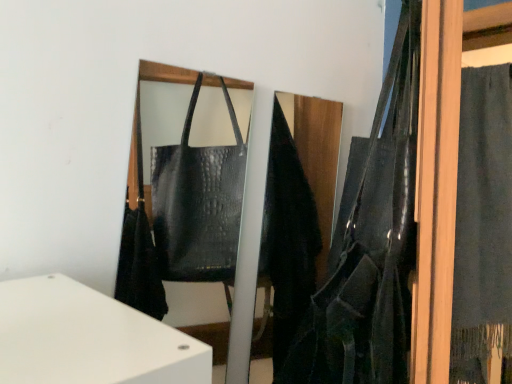
Where is `leather textured shoulder bag at right`? leather textured shoulder bag at right is located at coordinates (370, 245).

What do you see at coordinates (370, 245) in the screenshot? I see `leather textured shoulder bag at right` at bounding box center [370, 245].

What is the approximate height of leather textured shoulder bag at right?

leather textured shoulder bag at right is 84.03 centimeters in height.

Describe the element at coordinates (483, 228) in the screenshot. The image size is (512, 384). I see `dark blue fabric at right` at that location.

Identify the location of dark blue fabric at right. The width and height of the screenshot is (512, 384). (483, 228).

Where is `leather textured shoulder bag at right`? The width and height of the screenshot is (512, 384). leather textured shoulder bag at right is located at coordinates (370, 245).

Can you confirm if dark blue fabric at right is positioned to the right of leather textured shoulder bag at right?

Yes.

Which object is closer to the camera, dark blue fabric at right or leather textured shoulder bag at right?

Positioned in front is leather textured shoulder bag at right.

Does point (499, 85) come farther from viewer compared to point (377, 221)?

Yes, it is behind point (377, 221).

From the image's perspective, is dark blue fabric at right positioned above or below leather textured shoulder bag at right?

→ dark blue fabric at right is situated lower than leather textured shoulder bag at right in the image.

From a real-world perspective, relative to leather textured shoulder bag at right, is dark blue fabric at right vertically above or below?

In terms of real-world spatial position, dark blue fabric at right is below leather textured shoulder bag at right.

From the picture: Is dark blue fabric at right wider or thinner than leather textured shoulder bag at right?

Clearly, dark blue fabric at right has more width compared to leather textured shoulder bag at right.

Is dark blue fabric at right shorter than leather textured shoulder bag at right?

In fact, dark blue fabric at right may be taller than leather textured shoulder bag at right.

Can you confirm if dark blue fabric at right is smaller than leather textured shoulder bag at right?

Correct, dark blue fabric at right occupies less space than leather textured shoulder bag at right.

Is dark blue fabric at right outside of leather textured shoulder bag at right?

Yes, dark blue fabric at right is located beyond the bounds of leather textured shoulder bag at right.

Does dark blue fabric at right touch leather textured shoulder bag at right?

No.

Could you tell me if dark blue fabric at right is facing leather textured shoulder bag at right?

Yes.

How different are the orientations of dark blue fabric at right and leather textured shoulder bag at right in degrees?

115 degrees.

This screenshot has width=512, height=384. Find the location of `shoulder bag above the dark blue fabric at right (from the image's perspective)`. shoulder bag above the dark blue fabric at right (from the image's perspective) is located at coordinates (370, 245).

Between leather textured shoulder bag at right and dark blue fabric at right, which one appears on the left side from the viewer's perspective?

leather textured shoulder bag at right.

Is leather textured shoulder bag at right closer to the viewer compared to dark blue fabric at right?

That is True.

Which is behind, point (387, 163) or point (478, 219)?

The point (478, 219) is farther from the camera.

From the image's perspective, relative to dark blue fabric at right, is leather textured shoulder bag at right above or below?

leather textured shoulder bag at right is situated higher than dark blue fabric at right in the image.

From a real-world perspective, is leather textured shoulder bag at right on top of dark blue fabric at right?

Yes, from a real-world perspective, leather textured shoulder bag at right is above dark blue fabric at right.

Considering the relative sizes of leather textured shoulder bag at right and dark blue fabric at right in the image provided, is leather textured shoulder bag at right wider than dark blue fabric at right?

No.

Is leather textured shoulder bag at right taller or shorter than dark blue fabric at right?

In the image, leather textured shoulder bag at right appears to be shorter than dark blue fabric at right.

Considering the sizes of objects leather textured shoulder bag at right and dark blue fabric at right in the image provided, who is smaller, leather textured shoulder bag at right or dark blue fabric at right?

With smaller size is dark blue fabric at right.

Is leather textured shoulder bag at right outside of dark blue fabric at right?

Absolutely, leather textured shoulder bag at right is external to dark blue fabric at right.

Would you say leather textured shoulder bag at right is a long distance from dark blue fabric at right?

No, leather textured shoulder bag at right is not far from dark blue fabric at right.

Is leather textured shoulder bag at right facing towards dark blue fabric at right?

No.

Where is `curtain directly beneath the leather textured shoulder bag at right (from a real-world perspective)`? The width and height of the screenshot is (512, 384). curtain directly beneath the leather textured shoulder bag at right (from a real-world perspective) is located at coordinates (483, 228).

Locate an element on the screen. The width and height of the screenshot is (512, 384). curtain directly beneath the leather textured shoulder bag at right (from a real-world perspective) is located at coordinates (483, 228).

Where is `shoulder bag above the dark blue fabric at right (from the image's perspective)`? shoulder bag above the dark blue fabric at right (from the image's perspective) is located at coordinates (370, 245).